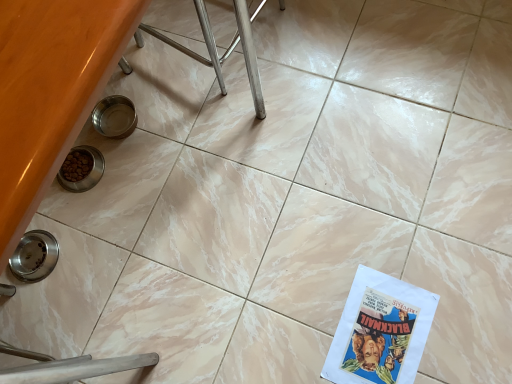
The width and height of the screenshot is (512, 384). Find the location of `free point above matte paper comic book at lower right (from a real-world perspective)`. free point above matte paper comic book at lower right (from a real-world perspective) is located at coordinates (380, 333).